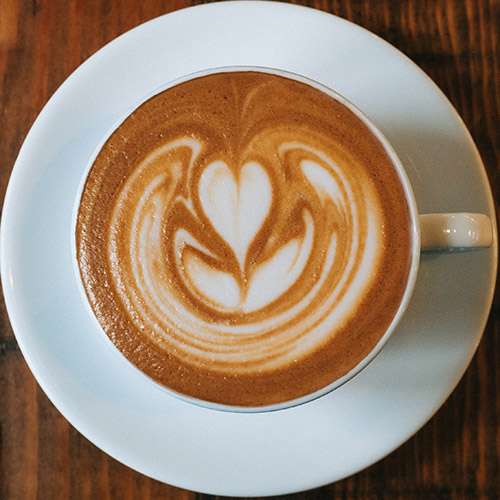
Where is `top of cup`? This screenshot has height=500, width=500. top of cup is located at coordinates (245, 64).